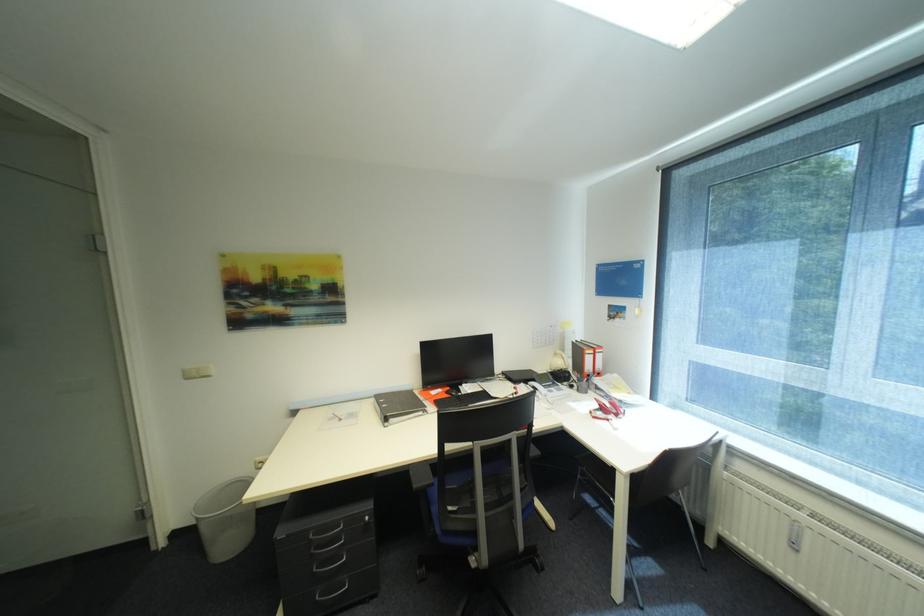
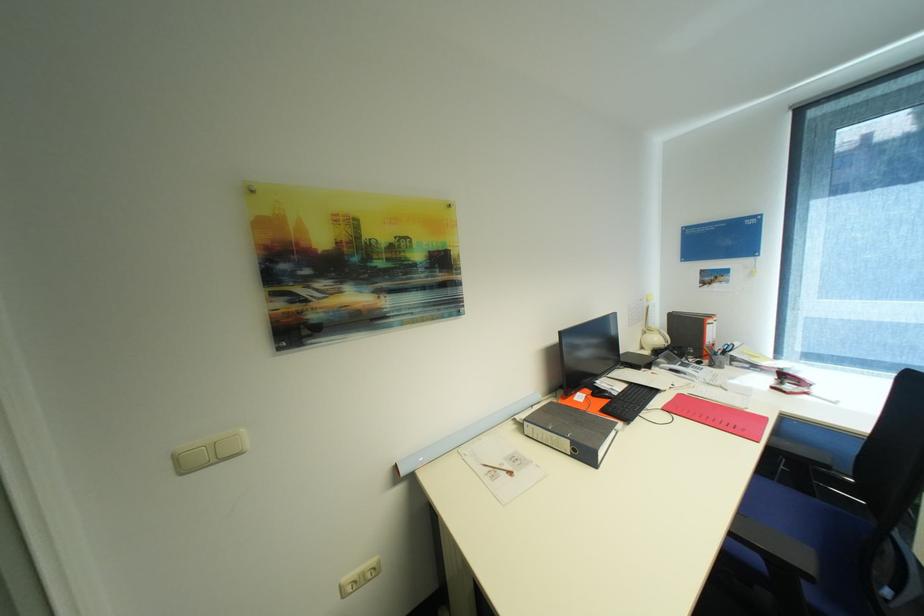
Where in the second image is the point corresponding to (x=262, y=463) from the first image?

(348, 586)